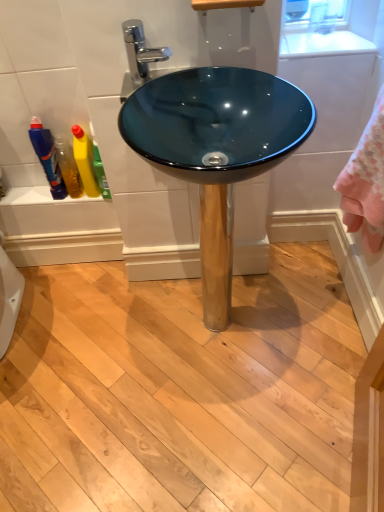
Locate an element on the screen. The image size is (384, 512). vacant position to the left of translucent plastic bottle at left is located at coordinates (36, 194).